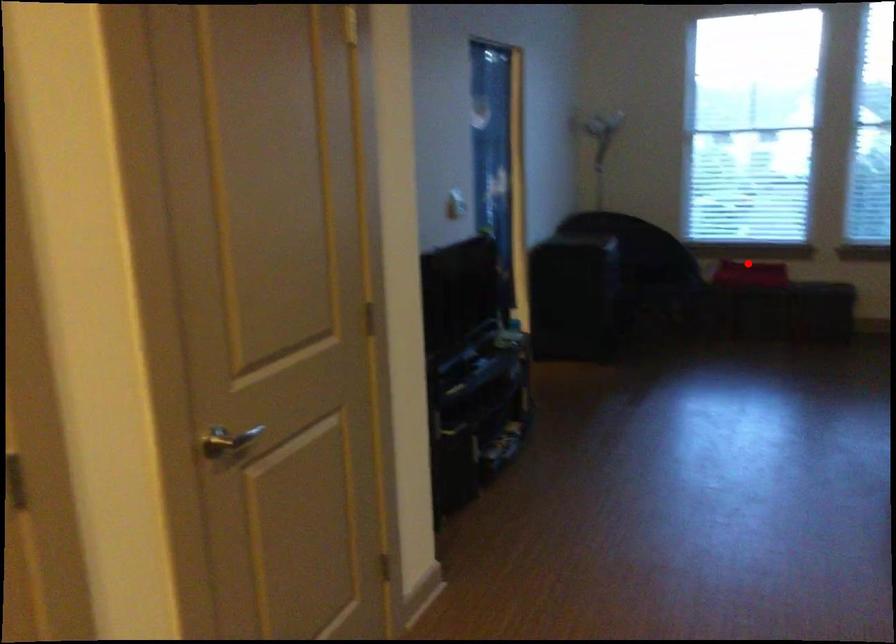
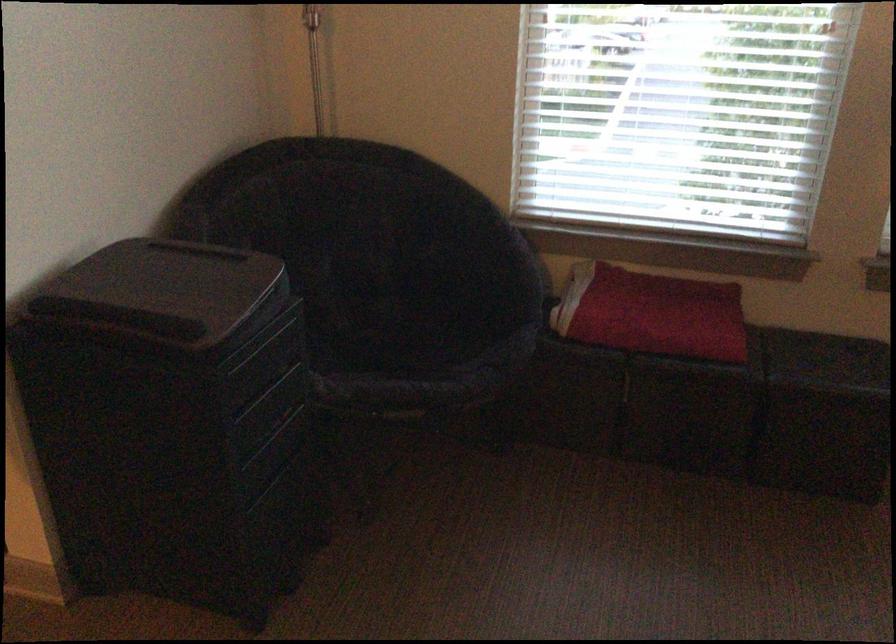
Question: I am providing you with two images of the same scene from different viewpoints. Image1 has a red point marked. In image2, the corresponding 3D location appears at what relative position? Reply with the corresponding letter.

Choices:
 (A) Closer
 (B) Farther

Answer: (A)